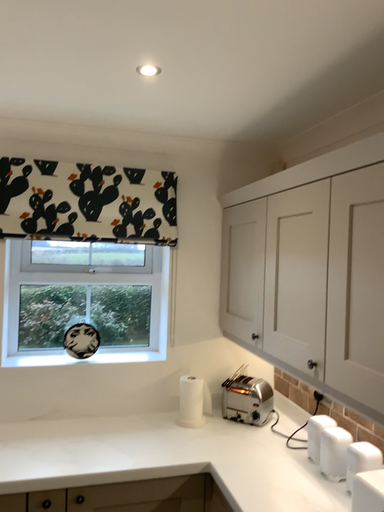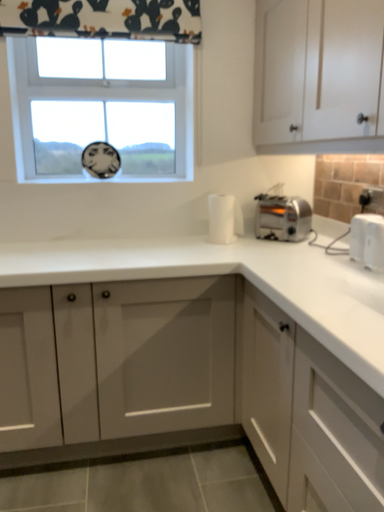
Question: Which way did the camera rotate in the video?

Choices:
 (A) rotated upward
 (B) rotated downward

Answer: (B)